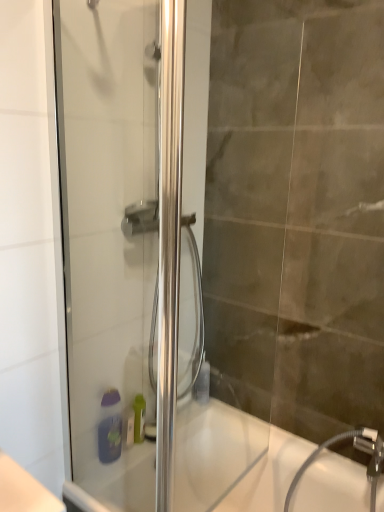
I want to click on purple matte soap dispenser at lower center, so click(110, 426).

Describe the element at coordinates (110, 231) in the screenshot. The height and width of the screenshot is (512, 384). I see `clear glass shower door at left` at that location.

Locate an element on the screen. white glossy bathtub at lower center is located at coordinates click(233, 460).

Where is `purple matte soap dispenser at lower center`? This screenshot has width=384, height=512. purple matte soap dispenser at lower center is located at coordinates (110, 426).

From a real-world perspective, does translucent plastic bottle at lower center stand above clear glass shower door at left?

Incorrect, from a real-world perspective, translucent plastic bottle at lower center is lower than clear glass shower door at left.

Is translucent plastic bottle at lower center at the right side of clear glass shower door at left?

Yes, translucent plastic bottle at lower center is to the right of clear glass shower door at left.

Which is closer to the camera, (208, 400) or (145, 310)?

Positioned in front is point (145, 310).

Between translucent plastic bottle at lower center and clear glass shower door at left, which one has larger size?

clear glass shower door at left.

Does clear glass shower door at left have a smaller size compared to purple matte soap dispenser at lower center?

No.

What's the angular difference between clear glass shower door at left and purple matte soap dispenser at lower center's facing directions?

clear glass shower door at left and purple matte soap dispenser at lower center are facing 86.5 degrees away from each other.

Considering the relative sizes of clear glass shower door at left and purple matte soap dispenser at lower center in the image provided, is clear glass shower door at left taller than purple matte soap dispenser at lower center?

Yes.

Is clear glass shower door at left inside the boundaries of purple matte soap dispenser at lower center, or outside?

clear glass shower door at left is spatially situated outside purple matte soap dispenser at lower center.

Which object is more forward, purple matte soap dispenser at lower center or clear glass shower door at left?

clear glass shower door at left is more forward.

Is purple matte soap dispenser at lower center thinner than clear glass shower door at left?

No.

Can you confirm if purple matte soap dispenser at lower center is shorter than clear glass shower door at left?

Correct, purple matte soap dispenser at lower center is not as tall as clear glass shower door at left.

Does purple matte soap dispenser at lower center have a smaller size compared to clear glass shower door at left?

Correct, purple matte soap dispenser at lower center occupies less space than clear glass shower door at left.

Which point is more forward, (200,369) or (118,413)?

The point (118,413) is closer.

Considering the positions of objects translucent plastic bottle at lower center and purple matte soap dispenser at lower center in the image provided, who is in front, translucent plastic bottle at lower center or purple matte soap dispenser at lower center?

purple matte soap dispenser at lower center is more forward.

From a real-world perspective, which object stands above the other?

From a 3D spatial view, purple matte soap dispenser at lower center is above.

In terms of height, does translucent plastic bottle at lower center look taller or shorter compared to purple matte soap dispenser at lower center?

In the image, translucent plastic bottle at lower center appears to be shorter than purple matte soap dispenser at lower center.

Is purple matte soap dispenser at lower center positioned far away from white glossy bathtub at lower center?

Actually, purple matte soap dispenser at lower center and white glossy bathtub at lower center are a little close together.

Can you confirm if purple matte soap dispenser at lower center is wider than white glossy bathtub at lower center?

Incorrect, the width of purple matte soap dispenser at lower center does not surpass that of white glossy bathtub at lower center.

The width and height of the screenshot is (384, 512). I want to click on bath lying below the purple matte soap dispenser at lower center (from the image's perspective), so click(x=233, y=460).

From the image's perspective, is purple matte soap dispenser at lower center above or below white glossy bathtub at lower center?

Clearly, from the image's perspective, purple matte soap dispenser at lower center is above white glossy bathtub at lower center.

Is clear glass shower door at left oriented away from white glossy bathtub at lower center?

No, clear glass shower door at left is not facing the opposite direction of white glossy bathtub at lower center.

Can white glossy bathtub at lower center be found inside clear glass shower door at left?

No, white glossy bathtub at lower center is not a part of clear glass shower door at left.

Is clear glass shower door at left far away from white glossy bathtub at lower center?

clear glass shower door at left is near white glossy bathtub at lower center, not far away.

From the image's perspective, does clear glass shower door at left appear lower than white glossy bathtub at lower center?

Actually, clear glass shower door at left appears above white glossy bathtub at lower center in the image.

Could translucent plastic bottle at lower center be considered to be inside white glossy bathtub at lower center?

No, translucent plastic bottle at lower center is not inside white glossy bathtub at lower center.

Are white glossy bathtub at lower center and translucent plastic bottle at lower center making contact?

white glossy bathtub at lower center and translucent plastic bottle at lower center are clearly separated.

How different are the orientations of white glossy bathtub at lower center and translucent plastic bottle at lower center in degrees?

The facing directions of white glossy bathtub at lower center and translucent plastic bottle at lower center are 91 degrees apart.

Image resolution: width=384 pixels, height=512 pixels. I want to click on toiletry above the white glossy bathtub at lower center (from the image's perspective), so click(x=202, y=384).

This screenshot has width=384, height=512. What are the coordinates of `toiletry below the clear glass shower door at left (from a real-world perspective)` in the screenshot? It's located at (202, 384).

The width and height of the screenshot is (384, 512). What are the coordinates of `soap dispenser located behind the clear glass shower door at left` in the screenshot? It's located at (110, 426).

Based on their spatial positions, is white glossy bathtub at lower center or clear glass shower door at left further from translucent plastic bottle at lower center?

clear glass shower door at left lies further to translucent plastic bottle at lower center than the other object.

Based on their spatial positions, is purple matte soap dispenser at lower center or white glossy bathtub at lower center further from clear glass shower door at left?

white glossy bathtub at lower center is positioned further to the anchor clear glass shower door at left.

Consider the image. Based on their spatial positions, is white glossy bathtub at lower center or clear glass shower door at left further from purple matte soap dispenser at lower center?

clear glass shower door at left is positioned further to the anchor purple matte soap dispenser at lower center.

When comparing their distances from clear glass shower door at left, does translucent plastic bottle at lower center or purple matte soap dispenser at lower center seem further?

translucent plastic bottle at lower center is further to clear glass shower door at left.

When comparing their distances from purple matte soap dispenser at lower center, does clear glass shower door at left or white glossy bathtub at lower center seem further?

Based on the image, clear glass shower door at left appears to be further to purple matte soap dispenser at lower center.

Which object lies further to the anchor point white glossy bathtub at lower center, translucent plastic bottle at lower center or clear glass shower door at left?

The object further to white glossy bathtub at lower center is clear glass shower door at left.

Which object lies nearer to the anchor point clear glass shower door at left, purple matte soap dispenser at lower center or translucent plastic bottle at lower center?

Based on the image, purple matte soap dispenser at lower center appears to be nearer to clear glass shower door at left.

Considering their positions, is translucent plastic bottle at lower center positioned further to purple matte soap dispenser at lower center than white glossy bathtub at lower center?

translucent plastic bottle at lower center lies further to purple matte soap dispenser at lower center than the other object.

I want to click on soap dispenser between clear glass shower door at left and translucent plastic bottle at lower center from front to back, so click(x=110, y=426).

Locate an element on the screen. soap dispenser between white glossy bathtub at lower center and translucent plastic bottle at lower center along the z-axis is located at coordinates (110, 426).

Identify the location of bath located between clear glass shower door at left and translucent plastic bottle at lower center in the depth direction. Image resolution: width=384 pixels, height=512 pixels. point(233,460).

Locate an element on the screen. Image resolution: width=384 pixels, height=512 pixels. soap dispenser between clear glass shower door at left and white glossy bathtub at lower center in the vertical direction is located at coordinates (110, 426).